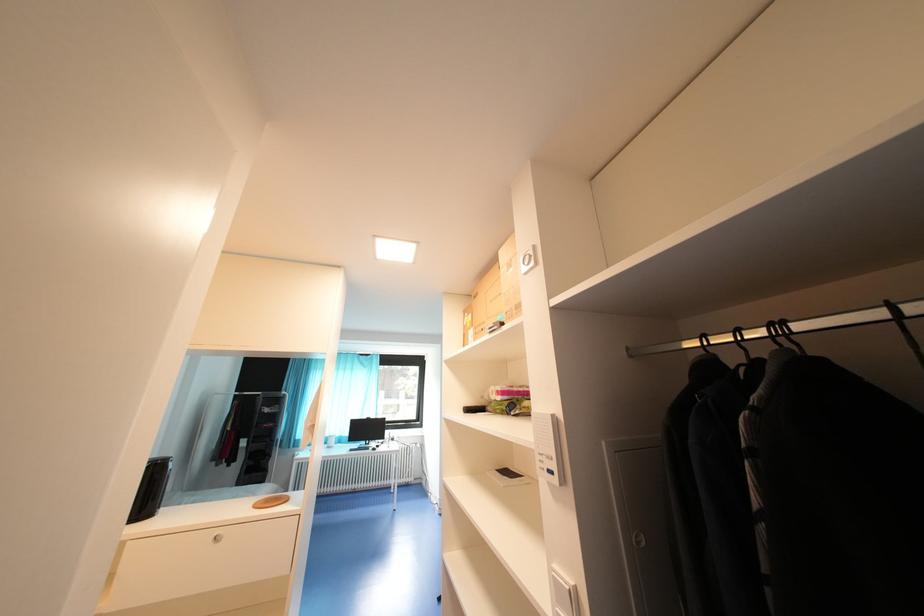
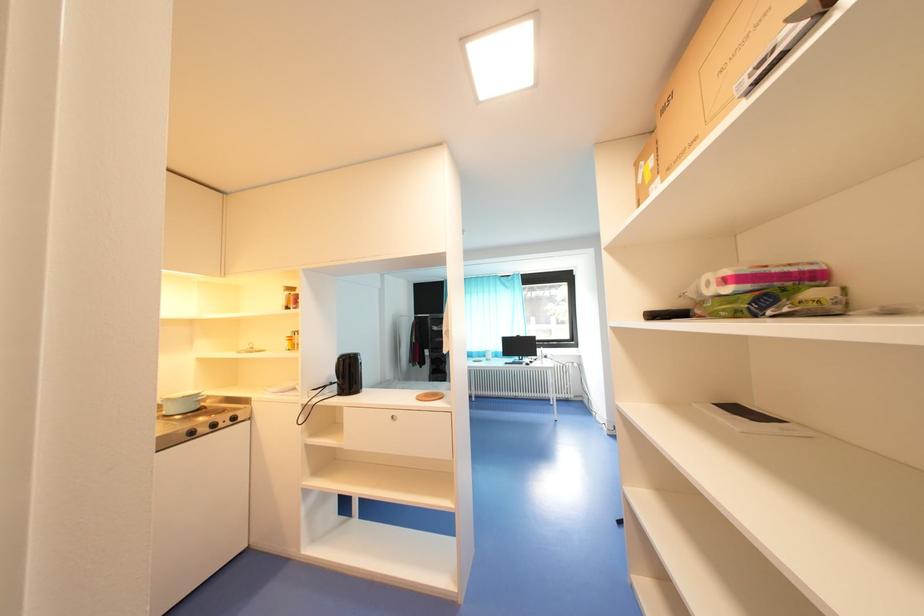
Question: Based on the continuous images, in which direction is the camera rotating? Reply with the corresponding letter.

Choices:
 (A) Left
 (B) Right
 (C) Up
 (D) Down

Answer: (A)